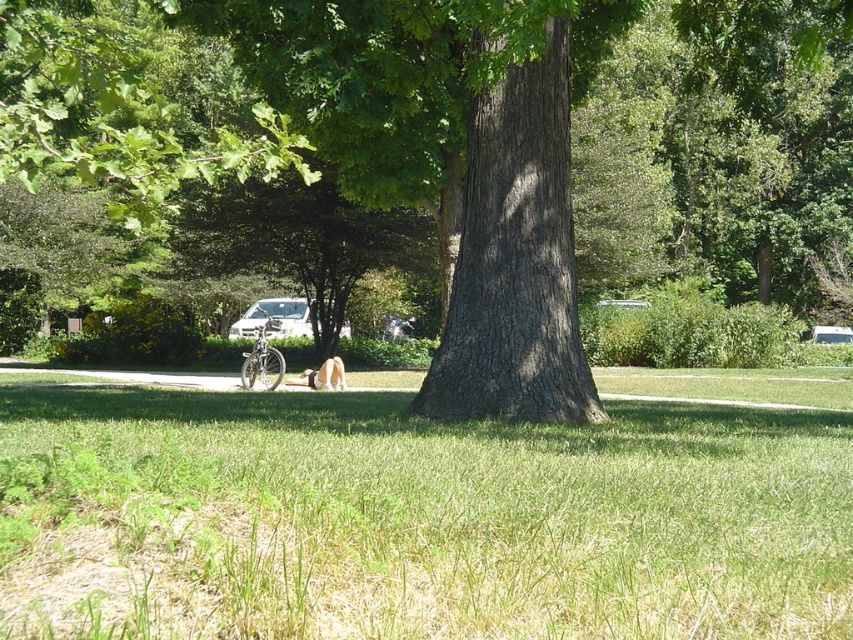
You are standing in the park and see the white matte car at center and the light brown fur at center. Which object is closer to you?

The white matte car at center is closer to you because it is further to the viewer than the light brown fur at center.

You are a delivery person needing to reach the light brown fur at center from the white matte car at center. Can you walk directly between them without needing to detour around any obstacles?

The distance between the white matte car at center and the light brown fur at center is 14.95 meters. Since there are no obstacles mentioned in the scene description, you can walk directly between them without needing to detour.

You are planning to set up a picnic blanket in the park. The green grass at center and the white matte car at center are in your way. Which object should you move to make space?

The white matte car at center should be moved because the green grass at center is located below it, so moving the car would free up the space above the grass for the picnic blanket.